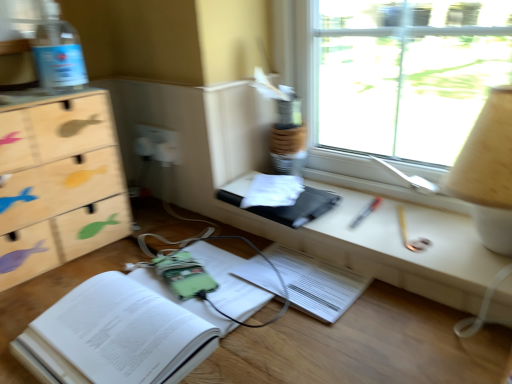
Question: From the image's perspective, is wooden fish-patterned chest of drawers at left positioned above or below white plastic electric outlet at center?

Choices:
 (A) above
 (B) below

Answer: (B)

Question: Is wooden fish-patterned chest of drawers at left in front of or behind white plastic electric outlet at center in the image?

Choices:
 (A) behind
 (B) front

Answer: (B)

Question: Which object is the closest to the transparent glass window at upper right?

Choices:
 (A) matte black tablet at center
 (B) green fabric book at lower left, arranged as the 2th paperback book when viewed from the top
 (C) black matte book at center, marked as the 2th paperback book in a bottom-to-top arrangement
 (D) wooden fish-patterned chest of drawers at left
 (E) white plastic electric outlet at center

Answer: (A)

Question: Which of these objects is positioned closest to the matte black tablet at center?

Choices:
 (A) wooden fish-patterned chest of drawers at left
 (B) green fabric book at lower left, arranged as the 2th paperback book when viewed from the top
 (C) transparent glass window at upper right
 (D) transparent plastic bottle at upper left
 (E) black matte book at center, positioned as the 1th paperback book in top-to-bottom order

Answer: (E)